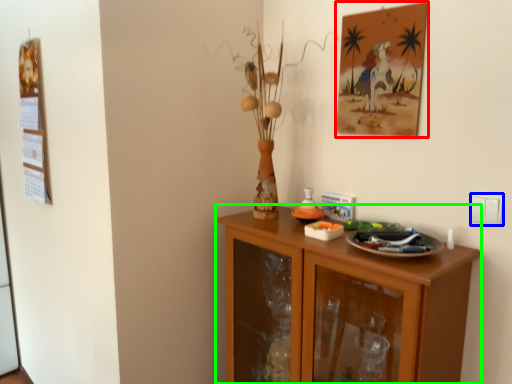
Question: Considering the real-world distances, which object is farthest from picture frame (highlighted by a red box)? electric outlet (highlighted by a blue box) or cabinetry (highlighted by a green box)?

Choices:
 (A) electric outlet
 (B) cabinetry

Answer: (B)